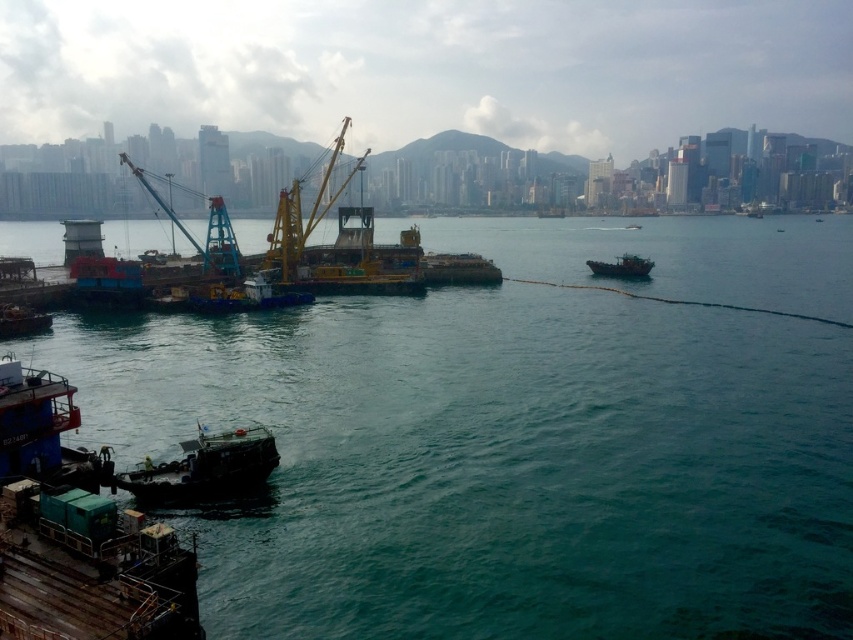
Question: Which is farther from the rusty metal boat at center right?

Choices:
 (A) dark gray metallic boat at lower left
 (B) teal water at center

Answer: (A)

Question: Considering the relative positions of teal water at center and dark gray metallic boat at lower left in the image provided, where is teal water at center located with respect to dark gray metallic boat at lower left?

Choices:
 (A) left
 (B) right

Answer: (B)

Question: Which point is farther to the camera?

Choices:
 (A) (437, 492)
 (B) (132, 474)
 (C) (631, 259)

Answer: (C)

Question: Among these objects, which one is farthest from the camera?

Choices:
 (A) teal water at center
 (B) dark gray metallic boat at lower left

Answer: (B)

Question: Does teal water at center come in front of rusty metal boat at center right?

Choices:
 (A) no
 (B) yes

Answer: (B)

Question: Observing the image, what is the correct spatial positioning of dark gray metallic boat at lower left in reference to rusty metal boat at center right?

Choices:
 (A) left
 (B) right

Answer: (A)